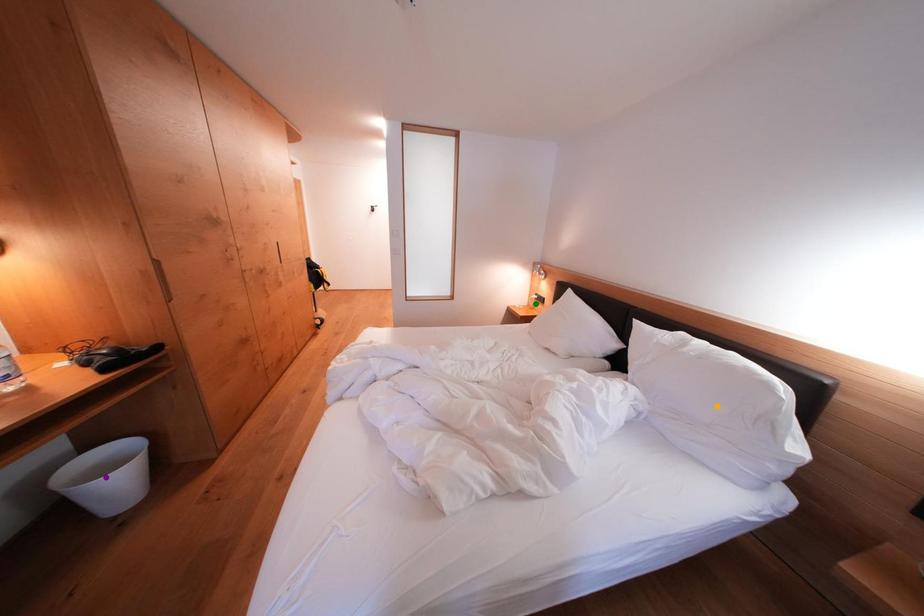
Order these from nearest to farthest:
purple point, orange point, green point

purple point, orange point, green point